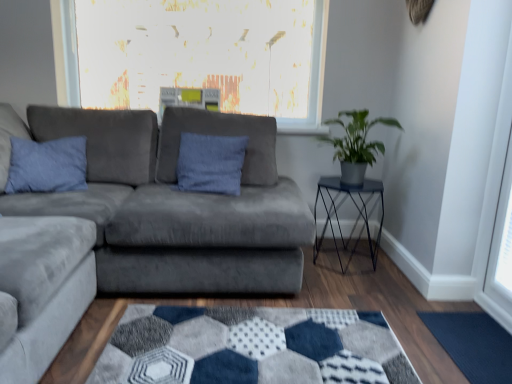
Question: From the image's perspective, is metallic black table at right located above or below green matte plant at right?

Choices:
 (A) below
 (B) above

Answer: (A)

Question: Considering their positions, is metallic black table at right located in front of or behind green matte plant at right?

Choices:
 (A) front
 (B) behind

Answer: (B)

Question: Considering the real-world distances, which object is farthest from the suede gray couch at center?

Choices:
 (A) metallic black table at right
 (B) blue suede pillow at left
 (C) green matte plant at right
 (D) dark blue textured mat at lower right

Answer: (D)

Question: Which object is the farthest from the suede gray couch at center?

Choices:
 (A) dark blue textured mat at lower right
 (B) blue suede pillow at left
 (C) green matte plant at right
 (D) metallic black table at right

Answer: (A)